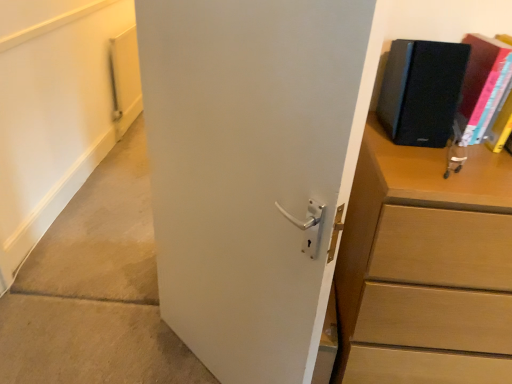
Question: Considering the relative sizes of black matte speaker at upper right, which is the second paperback book from right to left, and white matte door at center in the image provided, is black matte speaker at upper right, which is the second paperback book from right to left, wider than white matte door at center?

Choices:
 (A) yes
 (B) no

Answer: (A)

Question: Is black matte speaker at upper right, which is the second paperback book from right to left, looking in the opposite direction of white matte door at center?

Choices:
 (A) no
 (B) yes

Answer: (A)

Question: Is black matte speaker at upper right, which is the second paperback book from right to left, taller than white matte door at center?

Choices:
 (A) yes
 (B) no

Answer: (B)

Question: From the image's perspective, would you say black matte speaker at upper right, which is the first paperback book from left to right, is positioned over white matte door at center?

Choices:
 (A) yes
 (B) no

Answer: (A)

Question: Would you say white matte door at center is part of black matte speaker at upper right, which is the first paperback book from left to right,'s contents?

Choices:
 (A) yes
 (B) no

Answer: (B)

Question: From a real-world perspective, is black matte speaker at upper right, which is the second paperback book from right to left, below white matte door at center?

Choices:
 (A) no
 (B) yes

Answer: (A)

Question: Is matte black book at upper right, arranged as the 1th paperback book when viewed from the right, facing towards black matte speaker at upper right, which is the first paperback book from left to right?

Choices:
 (A) no
 (B) yes

Answer: (A)

Question: Would you say matte black book at upper right, arranged as the 1th paperback book when viewed from the right, is outside black matte speaker at upper right, which is the second paperback book from right to left?

Choices:
 (A) yes
 (B) no

Answer: (A)

Question: From the image's perspective, does matte black book at upper right, arranged as the second paperback book when viewed from the left, appear lower than black matte speaker at upper right, which is the second paperback book from right to left?

Choices:
 (A) no
 (B) yes

Answer: (B)

Question: From a real-world perspective, does matte black book at upper right, arranged as the 1th paperback book when viewed from the right, sit lower than black matte speaker at upper right, which is the second paperback book from right to left?

Choices:
 (A) no
 (B) yes

Answer: (B)

Question: Considering the relative sizes of matte black book at upper right, arranged as the second paperback book when viewed from the left, and black matte speaker at upper right, which is the first paperback book from left to right, in the image provided, is matte black book at upper right, arranged as the second paperback book when viewed from the left, taller than black matte speaker at upper right, which is the first paperback book from left to right,?

Choices:
 (A) no
 (B) yes

Answer: (B)

Question: Is black matte speaker at upper right, which is the first paperback book from left to right, surrounded by matte black book at upper right, arranged as the 1th paperback book when viewed from the right?

Choices:
 (A) no
 (B) yes

Answer: (A)

Question: Considering the relative positions of white matte door at center and wooden chest of drawers at right in the image provided, is white matte door at center in front of wooden chest of drawers at right?

Choices:
 (A) yes
 (B) no

Answer: (A)